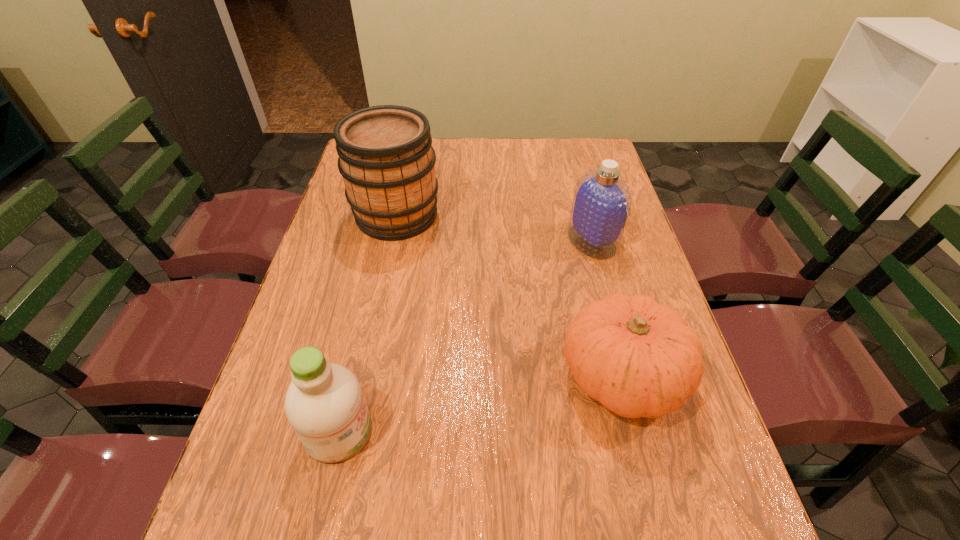
Locate an element on the screen. The height and width of the screenshot is (540, 960). vacant point located between the farther cleansing agent and the nearer cleansing agent is located at coordinates (466, 336).

Where is `free spot between the left cleansing agent and the farther cleansing agent`? This screenshot has height=540, width=960. free spot between the left cleansing agent and the farther cleansing agent is located at coordinates pyautogui.click(x=466, y=336).

The width and height of the screenshot is (960, 540). In order to click on unoccupied position between the left cleansing agent and the shortest object in this screenshot , I will do `click(480, 403)`.

Locate an element on the screen. free space between the nearer cleansing agent and the shortest object is located at coordinates (480, 403).

I want to click on vacant space that's between the cider and the pumpkin, so (509, 295).

Identify which object is located as the third nearest to the shortest object. Please provide its 2D coordinates. Your answer should be formatted as a tuple, i.e. [(x, y)], where the tuple contains the x and y coordinates of a point satisfying the conditions above.

[(386, 158)]

Where is `object that is the closest to the cider`? The height and width of the screenshot is (540, 960). object that is the closest to the cider is located at coordinates (601, 204).

Where is `blank area in the image that satisfies the following two spatial constraints: 1. on the back side of the right cleansing agent; 2. on the left side of the pumpkin`? The image size is (960, 540). blank area in the image that satisfies the following two spatial constraints: 1. on the back side of the right cleansing agent; 2. on the left side of the pumpkin is located at coordinates (588, 241).

The height and width of the screenshot is (540, 960). I want to click on vacant space that satisfies the following two spatial constraints: 1. on the front side of the right cleansing agent; 2. on the right side of the cider, so click(x=391, y=241).

This screenshot has height=540, width=960. Identify the location of blank area in the image that satisfies the following two spatial constraints: 1. on the front side of the farther cleansing agent; 2. on the front label of the left cleansing agent. (642, 431).